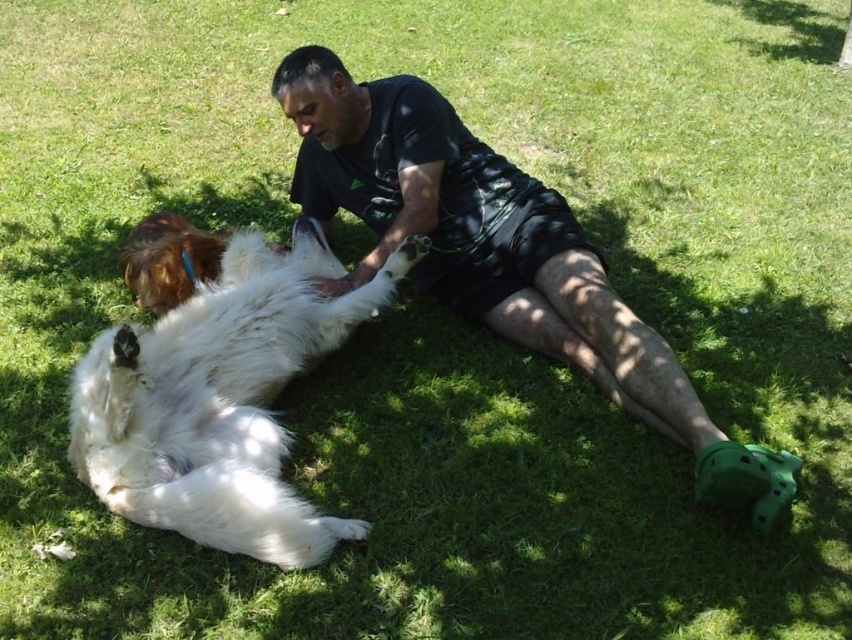
Looking at this image, you are standing at the origin point in the scene. There are two points marked in the image. Which point is closer to you, point (419, 198) or point (400, 276)?

Point (400, 276) is closer to you because it is in front of point (419, 198).

You are a photographer positioned 1 meter away from the black matte shorts at center. You want to capture a photo of the white fluffy dog at center without moving your camera. Can you do it?

Result: The distance between the black matte shorts at center and the white fluffy dog at center is 54.07 centimeters. Since you are already 1 meter away from the black matte shorts at center, the white fluffy dog at center is within your camera frame. Therefore, you can capture the white fluffy dog at center without moving your camera.